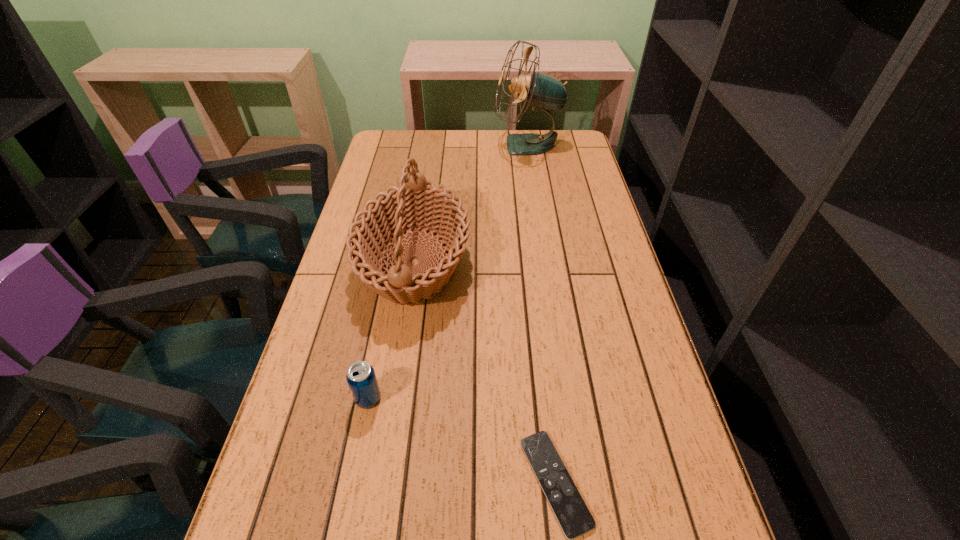
I want to click on free space that is in between the third shortest object and the tallest object, so click(x=471, y=204).

Identify the location of vacant space in between the second tallest object and the fan. (471, 204).

Find the location of a particular element. empty location between the third farthest object and the second farthest object is located at coordinates (392, 330).

Locate an element on the screen. object that stands as the third closest to the second nearest object is located at coordinates (541, 91).

You are a GUI agent. You are given a task and a screenshot of the screen. Output one action in this format:
    pyautogui.click(x=<x>, y=<y>)
    Task: Click on the object identified as the closest to the remote control
    The width and height of the screenshot is (960, 540).
    Given the screenshot: What is the action you would take?
    pyautogui.click(x=416, y=203)

Image resolution: width=960 pixels, height=540 pixels. I want to click on free space that satisfies the following two spatial constraints: 1. on the back side of the pop soda; 2. on the left side of the third shortest object, so click(x=396, y=263).